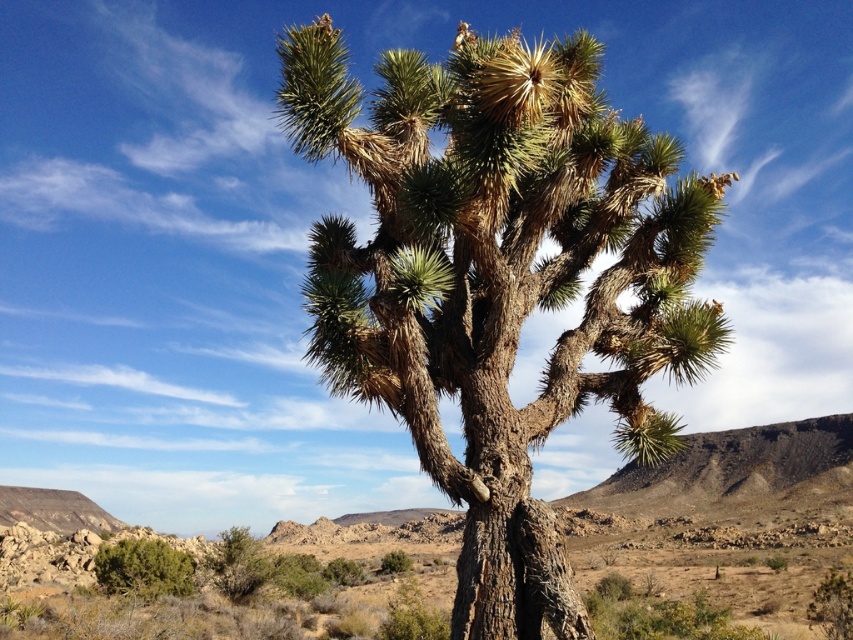
Image resolution: width=853 pixels, height=640 pixels. I want to click on brown rough desert at center, so click(x=722, y=497).

Is point (741, 541) farther from camera compared to point (213, 582)?

Yes.

This screenshot has height=640, width=853. In order to click on brown rough desert at center in this screenshot , I will do `click(722, 497)`.

Can you confirm if green spiny tree at center is bigger than green leafy bush at lower left?

Correct, green spiny tree at center is larger in size than green leafy bush at lower left.

Is point (502, 440) positioned before point (132, 586)?

That is True.

You are a GUI agent. You are given a task and a screenshot of the screen. Output one action in this format:
    pyautogui.click(x=<x>, y=<y>)
    Task: Click on the green spiny tree at center
    The height and width of the screenshot is (640, 853).
    Given the screenshot: What is the action you would take?
    tap(498, 280)

Is green spiny tree at center closer to the viewer compared to brown rough desert at center?

Yes, green spiny tree at center is in front of brown rough desert at center.

Who is lower down, green spiny tree at center or brown rough desert at center?

Positioned lower is brown rough desert at center.

Identify the location of green spiny tree at center. tap(498, 280).